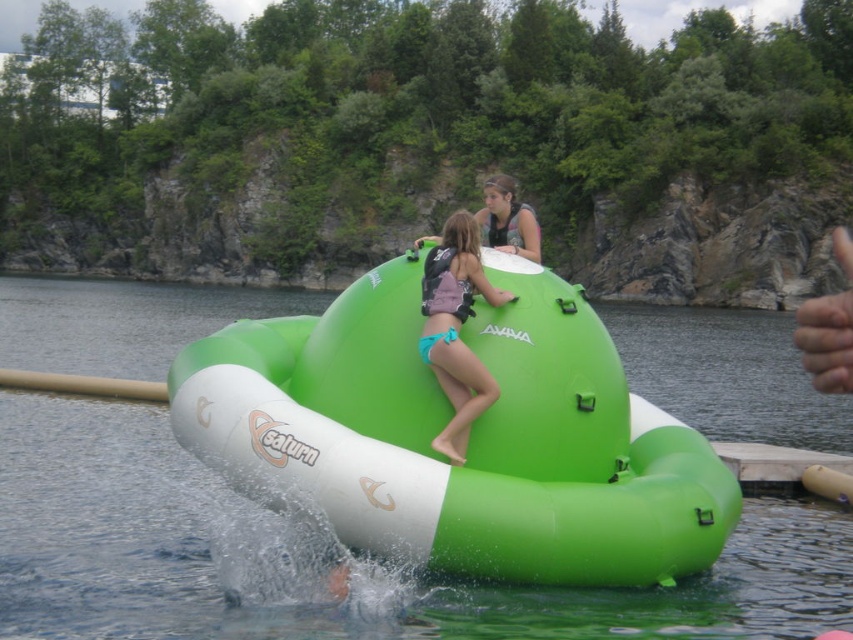
Between green rubber boat at center and teal fabric bikini at center, which one is positioned higher?

Positioned higher is teal fabric bikini at center.

Is green rubber boat at center below teal fabric bikini at center?

Yes.

Who is more forward, (637, 396) or (456, 273)?

Point (456, 273)

At what (x,y) coordinates should I click in order to perform the action: click on green rubber boat at center. Please return your answer as a coordinate pair (x, y). Looking at the image, I should click on (469, 440).